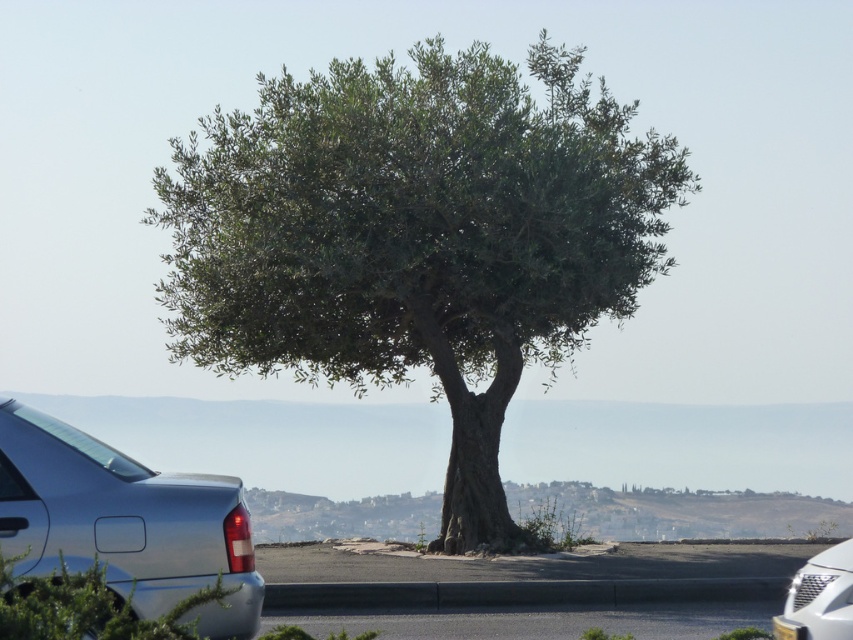
Question: Which point is closer to the camera?

Choices:
 (A) (819, 593)
 (B) (409, 340)
 (C) (225, 557)

Answer: (C)

Question: Estimate the real-world distances between objects in this image. Which object is closer to the green leafy tree at center?

Choices:
 (A) satin metallic car at lower left
 (B) silver metallic car at lower right

Answer: (A)

Question: Considering the relative positions of green leafy tree at center and silver metallic car at lower right in the image provided, where is green leafy tree at center located with respect to silver metallic car at lower right?

Choices:
 (A) below
 (B) above

Answer: (B)

Question: Which point is closer to the camera?

Choices:
 (A) (219, 563)
 (B) (801, 614)

Answer: (A)

Question: Can you confirm if green leafy tree at center is thinner than satin metallic car at lower left?

Choices:
 (A) yes
 (B) no

Answer: (B)

Question: Does satin metallic car at lower left have a lesser width compared to silver metallic car at lower right?

Choices:
 (A) yes
 (B) no

Answer: (B)